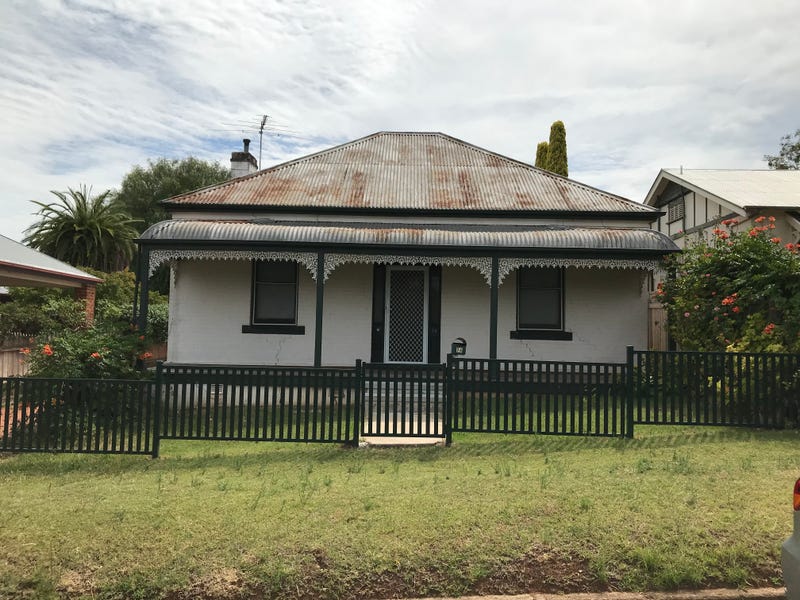
At what (x,y) coordinates should I click in order to perform the action: click on window pane. Please return your answer as a coordinate pair (x, y). Image resolution: width=800 pixels, height=600 pixels. Looking at the image, I should click on (272, 299).